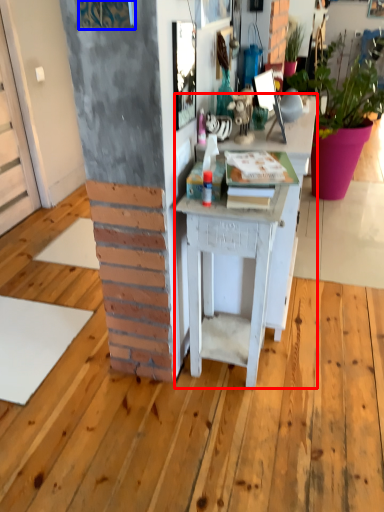
Question: Which object appears closest to the camera in this image, desk (highlighted by a red box) or picture frame (highlighted by a blue box)?

Choices:
 (A) desk
 (B) picture frame

Answer: (B)